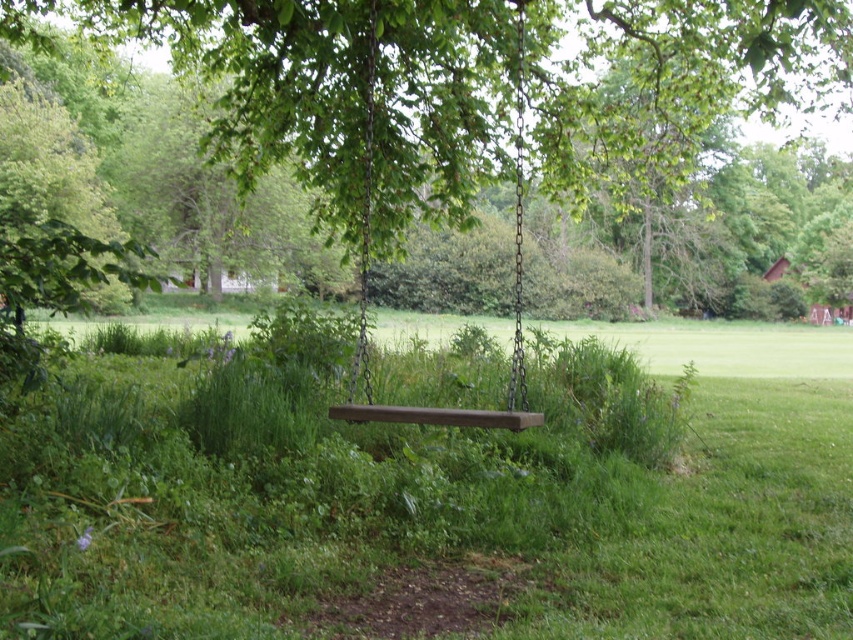
Question: Which of the following is the farthest from the observer?

Choices:
 (A) (10, 564)
 (B) (399, 150)

Answer: (B)

Question: Which is farther from the green grassy at center?

Choices:
 (A) green wood swing at center
 (B) brown wooden swing at center

Answer: (B)

Question: Which object is the farthest from the green wood swing at center?

Choices:
 (A) brown wooden swing at center
 (B) green grassy at center

Answer: (B)

Question: Is green grassy at center closer to the viewer compared to green wood swing at center?

Choices:
 (A) no
 (B) yes

Answer: (B)

Question: Is green grassy at center above green wood swing at center?

Choices:
 (A) yes
 (B) no

Answer: (B)

Question: Can you confirm if green wood swing at center is smaller than brown wooden swing at center?

Choices:
 (A) no
 (B) yes

Answer: (A)